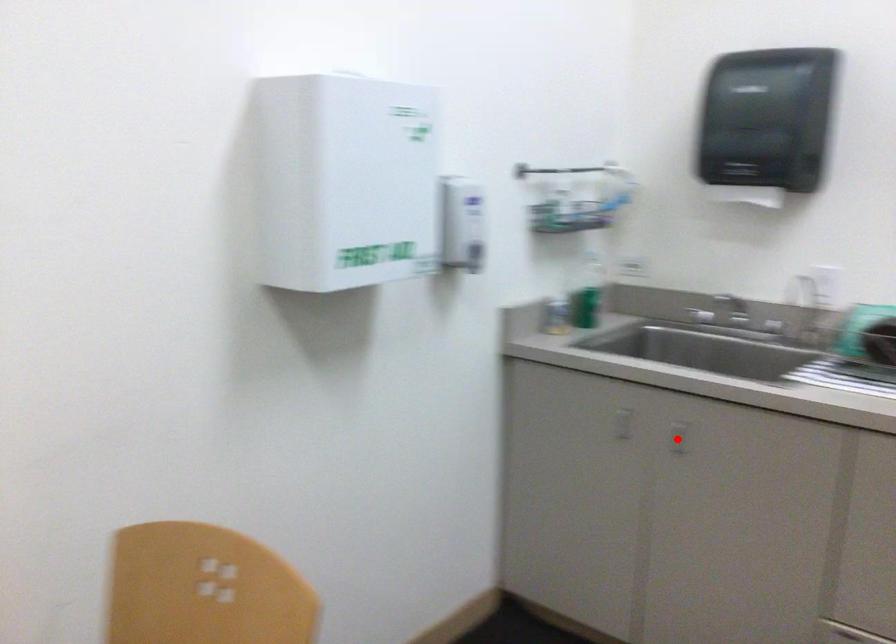
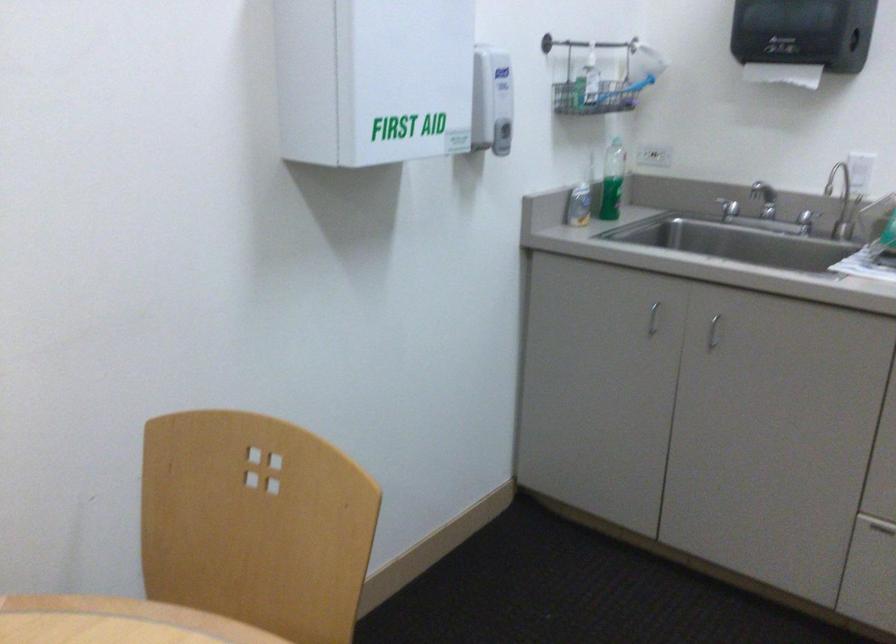
Locate, in the second image, the point that corresponds to the highlighted location in the first image.

(712, 332)